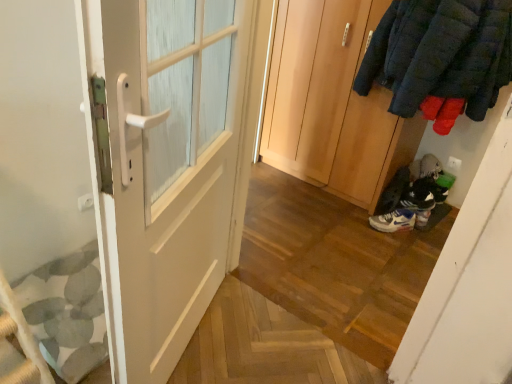
Question: Is wooden wardrobe at center, the 1th door when ordered from right to left, facing away from white matte sneaker at lower right, the first footwear viewed from the left?

Choices:
 (A) yes
 (B) no

Answer: (B)

Question: Is wooden wardrobe at center, the second door when ordered from left to right, completely or partially outside of white matte sneaker at lower right, positioned as the 2th footwear in right-to-left order?

Choices:
 (A) no
 (B) yes

Answer: (B)

Question: Is white matte sneaker at lower right, positioned as the 2th footwear in right-to-left order, located within wooden wardrobe at center, arranged as the first door when viewed from the back?

Choices:
 (A) yes
 (B) no

Answer: (B)

Question: Is wooden wardrobe at center, the second door viewed from the front, aimed at white matte sneaker at lower right, the first footwear viewed from the left?

Choices:
 (A) no
 (B) yes

Answer: (A)

Question: From a real-world perspective, is wooden wardrobe at center, the second door when ordered from left to right, located higher than white matte sneaker at lower right, positioned as the 2th footwear in right-to-left order?

Choices:
 (A) yes
 (B) no

Answer: (A)

Question: From the image's perspective, relative to white matte sneaker at lower right, positioned as the 2th footwear in right-to-left order, is white leather sneakers at lower right, which is the 1th footwear in right-to-left order, above or below?

Choices:
 (A) below
 (B) above

Answer: (B)

Question: From a real-world perspective, is white leather sneakers at lower right, which is the 1th footwear in right-to-left order, positioned above or below white matte sneaker at lower right, the first footwear viewed from the left?

Choices:
 (A) above
 (B) below

Answer: (A)

Question: Is white leather sneakers at lower right, which appears as the second footwear when viewed from the left, to the left or to the right of white matte sneaker at lower right, positioned as the 2th footwear in right-to-left order, in the image?

Choices:
 (A) right
 (B) left

Answer: (A)

Question: Considering the positions of point (400, 173) and point (396, 223), is point (400, 173) closer or farther from the camera than point (396, 223)?

Choices:
 (A) farther
 (B) closer

Answer: (A)

Question: Looking at their shapes, would you say white matte sneaker at lower right, positioned as the 2th footwear in right-to-left order, is wider or thinner than white leather sneakers at lower right, which appears as the second footwear when viewed from the left?

Choices:
 (A) thin
 (B) wide

Answer: (A)

Question: From their relative heights in the image, would you say white matte sneaker at lower right, positioned as the 2th footwear in right-to-left order, is taller or shorter than white leather sneakers at lower right, which is the 1th footwear in right-to-left order?

Choices:
 (A) tall
 (B) short

Answer: (B)

Question: Is white matte sneaker at lower right, the first footwear viewed from the left, to the left or to the right of white leather sneakers at lower right, which appears as the second footwear when viewed from the left, in the image?

Choices:
 (A) right
 (B) left

Answer: (B)

Question: From a real-world perspective, is white matte sneaker at lower right, the first footwear viewed from the left, above or below white leather sneakers at lower right, which is the 1th footwear in right-to-left order?

Choices:
 (A) above
 (B) below

Answer: (B)

Question: Is white matte door at left, which is the first door in front-to-back order, bigger or smaller than white matte sneaker at lower right, the first footwear viewed from the left?

Choices:
 (A) small
 (B) big

Answer: (B)

Question: From the image's perspective, relative to white matte sneaker at lower right, the first footwear viewed from the left, is white matte door at left, which is the first door in front-to-back order, above or below?

Choices:
 (A) above
 (B) below

Answer: (A)